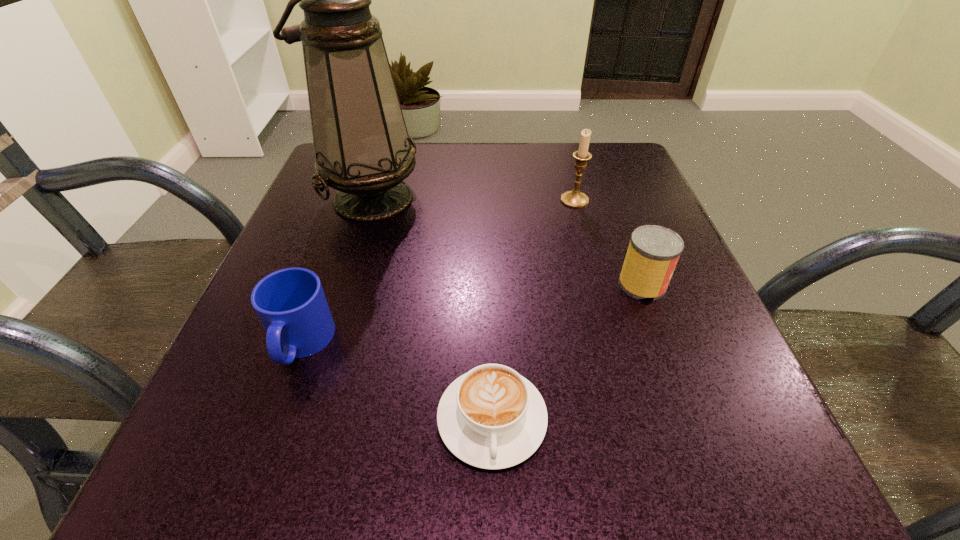
Locate an element on the screen. This screenshot has height=540, width=960. free spot that satisfies the following two spatial constraints: 1. on the front side of the third farthest object; 2. on the right side of the second tallest object is located at coordinates (597, 285).